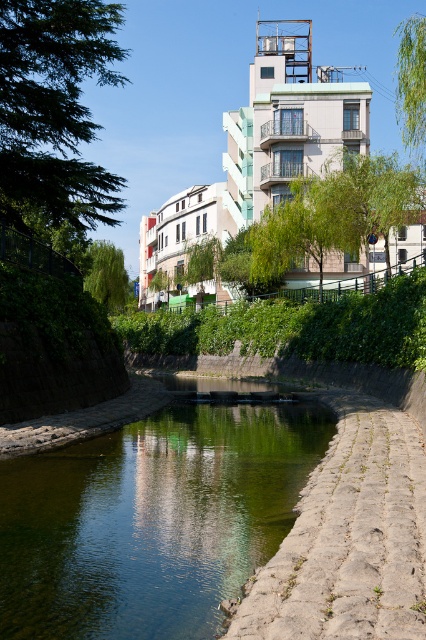
You are a tourist standing at the edge of the canal and want to take a photo of both the stone textured path at lower right and the green leafy tree at left. Which object should you position closer to the left side of your camera frame to include both in the shot?

You should position the green leafy tree at left closer to the left side of your camera frame because the stone textured path at lower right is on the right side of it, ensuring both objects are included in the shot.

Consider the image. You are a landscape architect designing a new pathway between the green smooth water at center and the green leafy tree at upper left. The pathway must be exactly 15 meters long. Can you fit the pathway between them without exceeding the required length?

The distance between the green smooth water at center and the green leafy tree at upper left is 15.29 meters. Since the required pathway length is 15 meters, the pathway will be 0.29 meters shorter than the actual distance between them. Therefore, it cannot be fitted without exceeding the required length.